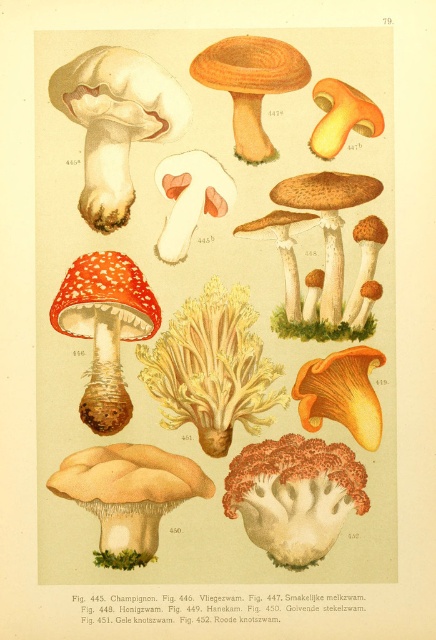
Does beige matte mushroom at lower left have a lesser width compared to smooth yellow mushroom at upper right?

In fact, beige matte mushroom at lower left might be wider than smooth yellow mushroom at upper right.

Consider the image. Can you confirm if beige matte mushroom at lower left is smaller than smooth yellow mushroom at upper right?

Incorrect, beige matte mushroom at lower left is not smaller in size than smooth yellow mushroom at upper right.

Is point (122, 472) closer to camera compared to point (314, 147)?

No.

Locate an element on the screen. beige matte mushroom at lower left is located at coordinates (129, 496).

Can you confirm if smooth orange cap at center is taller than smooth orange mushroom at center?

Yes, smooth orange cap at center is taller than smooth orange mushroom at center.

Can you confirm if smooth orange cap at center is positioned to the right of smooth orange mushroom at center?

In fact, smooth orange cap at center is to the left of smooth orange mushroom at center.

Is point (297, 65) positioned after point (299, 388)?

That is False.

Where is `smooth orange cap at center`? Image resolution: width=436 pixels, height=640 pixels. smooth orange cap at center is located at coordinates (251, 84).

Can you confirm if smooth orange cap at center is taller than brown matte mushroom at center?

No.

The image size is (436, 640). What do you see at coordinates (251, 84) in the screenshot?
I see `smooth orange cap at center` at bounding box center [251, 84].

The width and height of the screenshot is (436, 640). Identify the location of smooth orange cap at center. (251, 84).